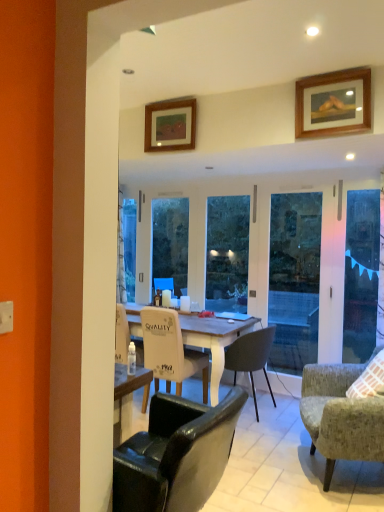
Find the location of a particular element. The image size is (384, 512). vacant space situated above wooden picture frame at upper right, the first picture frame when ordered from right to left (from a real-world perspective) is located at coordinates (328, 73).